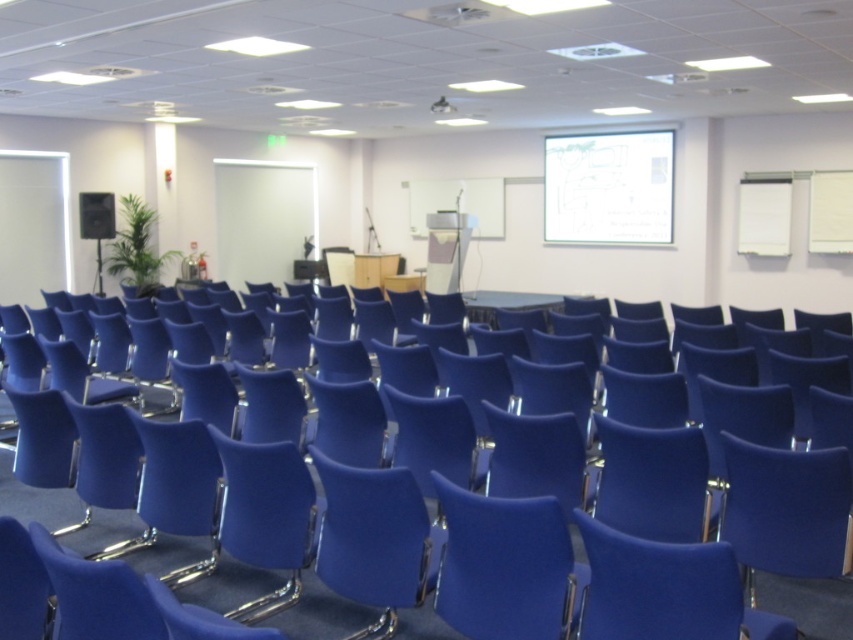
Question: Is matte blue chair at center to the right of white paper at upper center from the viewer's perspective?

Choices:
 (A) no
 (B) yes

Answer: (A)

Question: Estimate the real-world distances between objects in this image. Which object is closer to the white paper at upper center?

Choices:
 (A) matte black speaker at left
 (B) blue fabric swivel chair at center

Answer: (A)

Question: Which of the following is the closest to the observer?

Choices:
 (A) matte black speaker at left
 (B) matte blue chair at center

Answer: (B)

Question: Can you confirm if blue fabric swivel chair at center is positioned to the right of matte blue chair at center?

Choices:
 (A) yes
 (B) no

Answer: (A)

Question: Which object appears farthest from the camera in this image?

Choices:
 (A) matte black speaker at left
 (B) white paper at upper center
 (C) matte blue chair at center

Answer: (B)

Question: Is blue fabric swivel chair at center closer to the viewer compared to matte black speaker at left?

Choices:
 (A) no
 (B) yes

Answer: (B)